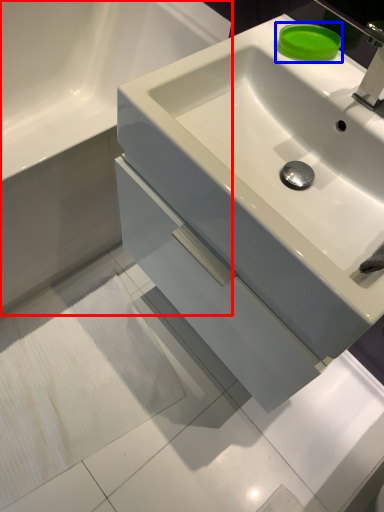
Question: Which object appears farthest to the camera in this image, bathroom cabinet (highlighted by a red box) or soap (highlighted by a blue box)?

Choices:
 (A) bathroom cabinet
 (B) soap

Answer: (B)